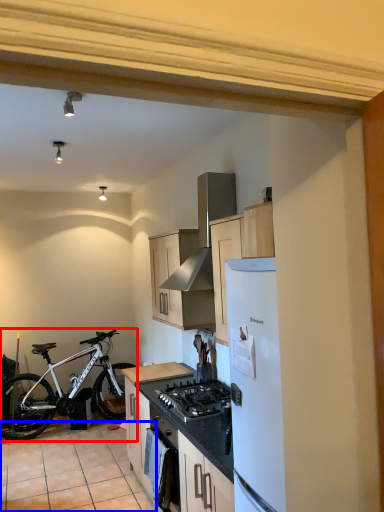
Question: Which object appears closest to the camera in this image, bicycle (highlighted by a red box) or tile (highlighted by a blue box)?

Choices:
 (A) bicycle
 (B) tile

Answer: (B)